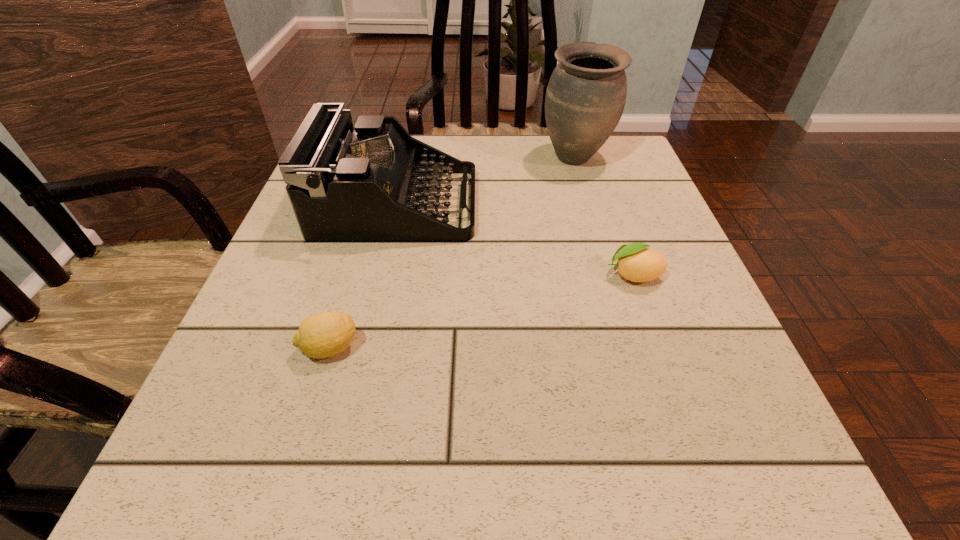
Where is `free location located with leaves positioned above the second nearest object`? The width and height of the screenshot is (960, 540). free location located with leaves positioned above the second nearest object is located at coordinates (416, 275).

At what (x,y) coordinates should I click in order to perform the action: click on vacant point located at the stem end of the nearer lemon. Please return your answer as a coordinate pair (x, y). The image size is (960, 540). Looking at the image, I should click on (404, 348).

Where is `urn that is positioned at the far edge`? urn that is positioned at the far edge is located at coordinates (585, 98).

Identify the location of typewriter at the far edge. The image size is (960, 540). (366, 184).

You are a GUI agent. You are given a task and a screenshot of the screen. Output one action in this format:
    pyautogui.click(x=<x>, y=<y>)
    Task: Click on the typewriter present at the left edge
    This screenshot has width=960, height=540.
    Given the screenshot: What is the action you would take?
    pyautogui.click(x=366, y=184)

Image resolution: width=960 pixels, height=540 pixels. I want to click on lemon that is at the left edge, so click(x=323, y=335).

This screenshot has width=960, height=540. I want to click on urn that is at the right edge, so (585, 98).

At what (x,y) coordinates should I click in order to perform the action: click on lemon at the right edge. Please return your answer as a coordinate pair (x, y). The width and height of the screenshot is (960, 540). Looking at the image, I should click on (637, 263).

The image size is (960, 540). I want to click on object that is at the far left corner, so coord(366,184).

The height and width of the screenshot is (540, 960). In order to click on object positioned at the far right corner in this screenshot , I will do `click(585, 98)`.